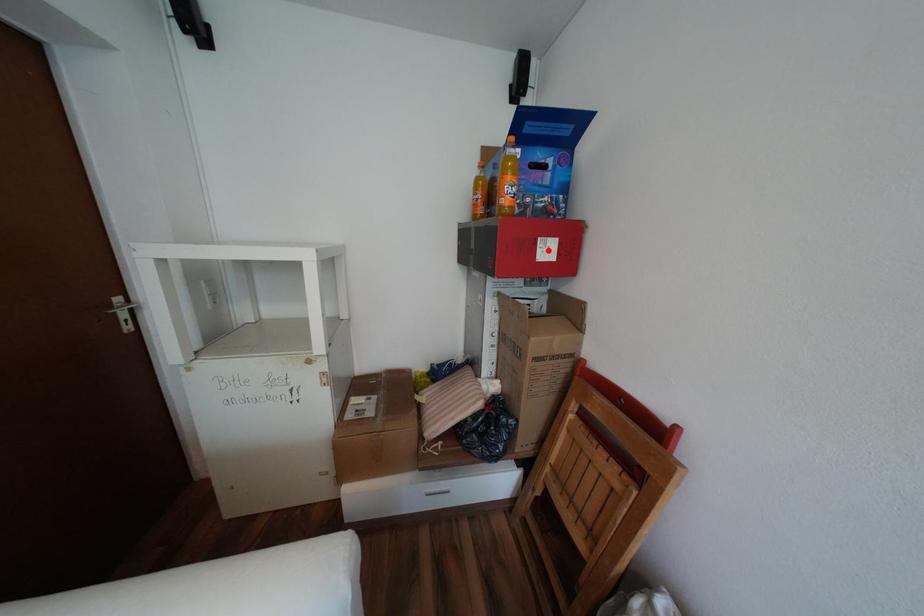
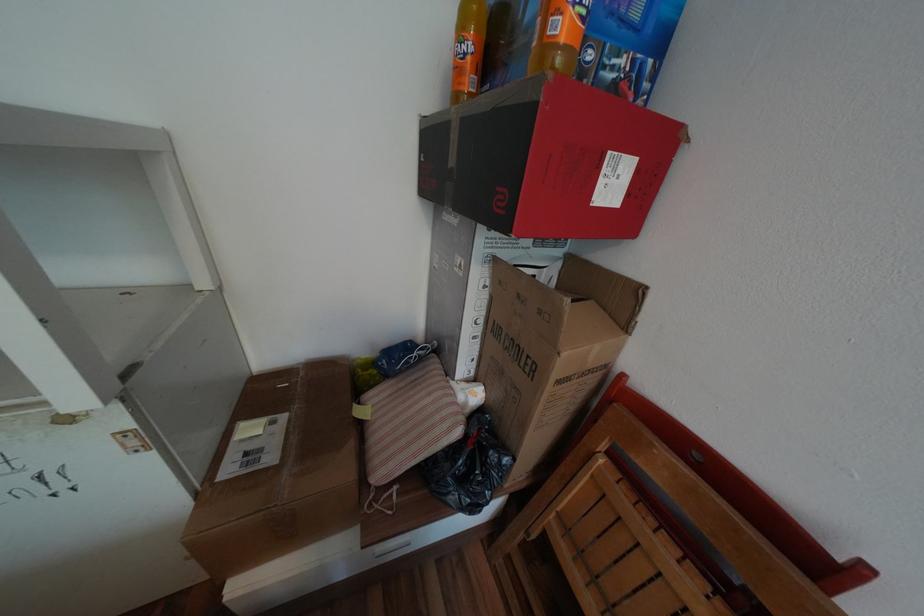
Question: I am providing you with two images of the same scene from different viewpoints. Image1 has a red point marked. In image2, the corresponding 3D location appears at what relative position? Reply with the corresponding letter.

Choices:
 (A) Closer
 (B) Farther

Answer: (B)